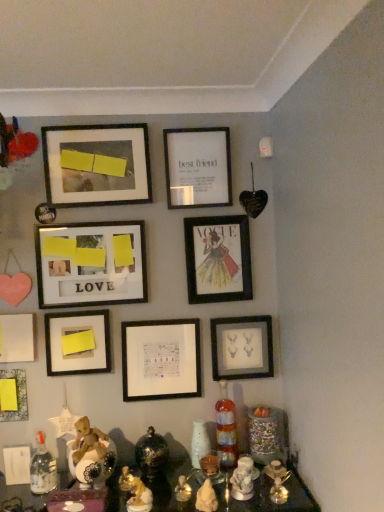
Identify the location of matte black picture frame at center, the second picture frame when ordered from bottom to top. click(161, 359).

Describe the element at coordinates (42, 468) in the screenshot. I see `translucent glass bottle at lower left, which ranks as the second bottle in back-to-front order` at that location.

Describe the element at coordinates (197, 167) in the screenshot. I see `white matte picture frame at upper center, which is the 9th picture frame from bottom to top` at that location.

This screenshot has width=384, height=512. Find the location of `white matte paper at lower left, marked as the 5th picture frame in a bottom-to-top arrangement`. white matte paper at lower left, marked as the 5th picture frame in a bottom-to-top arrangement is located at coordinates (16, 338).

Where is `matte black picture frame at center, the second picture frame when ordered from bottom to top`? The width and height of the screenshot is (384, 512). matte black picture frame at center, the second picture frame when ordered from bottom to top is located at coordinates tap(161, 359).

This screenshot has width=384, height=512. I want to click on the 2nd picture frame located above the matte wooden picture frame at center-left, positioned as the sixth picture frame in bottom-to-top order (from a real-world perspective), so click(197, 167).

In the scene shown: Which object is more forward, matte wooden picture frame at center-left, positioned as the sixth picture frame in bottom-to-top order, or white matte picture frame at upper center, which is the 9th picture frame from bottom to top?

matte wooden picture frame at center-left, positioned as the sixth picture frame in bottom-to-top order, is closer to the camera.

Is matte wooden picture frame at center-left, which ranks as the 4th picture frame in top-to-bottom order, not within white matte picture frame at upper center, which is the 9th picture frame from bottom to top?

Yes, matte wooden picture frame at center-left, which ranks as the 4th picture frame in top-to-bottom order, is outside of white matte picture frame at upper center, which is the 9th picture frame from bottom to top.

From the picture: Does matte wooden picture frame at center-left, positioned as the sixth picture frame in bottom-to-top order, appear on the right side of white matte picture frame at upper center, the first picture frame viewed from the top?

No.

Is the surface of matte black frame at center-right, the seventh picture frame in the top-to-bottom sequence, in direct contact with matte black picture frame at center, the second picture frame when ordered from bottom to top?

No, matte black frame at center-right, the seventh picture frame in the top-to-bottom sequence, is not next to matte black picture frame at center, the second picture frame when ordered from bottom to top.

From the picture: Does matte black frame at center-right, the seventh picture frame in the top-to-bottom sequence, have a greater height compared to matte black picture frame at center, the second picture frame when ordered from bottom to top?

No.

Measure the distance between matte black frame at center-right, the seventh picture frame in the top-to-bottom sequence, and matte black picture frame at center, the second picture frame when ordered from bottom to top.

matte black frame at center-right, the seventh picture frame in the top-to-bottom sequence, is 8.63 inches from matte black picture frame at center, the second picture frame when ordered from bottom to top.

From the image's perspective, which is above, matte black frame at center-right, the seventh picture frame in the top-to-bottom sequence, or matte black picture frame at center, the eighth picture frame when ordered from top to bottom?

From the image's view, matte black frame at center-right, the seventh picture frame in the top-to-bottom sequence, is above.

Based on the photo, which is more to the left, matte black picture frame at center, the eighth picture frame when ordered from top to bottom, or translucent glass candle holder at center?

matte black picture frame at center, the eighth picture frame when ordered from top to bottom.

Is matte black picture frame at center, the second picture frame when ordered from bottom to top, touching translucent glass candle holder at center?

No, matte black picture frame at center, the second picture frame when ordered from bottom to top, is not in contact with translucent glass candle holder at center.

At what (x,y) coordinates should I click in order to perform the action: click on candle holder that is under the matte black picture frame at center, the eighth picture frame when ordered from top to bottom (from a real-world perspective). Please return your answer as a coordinate pair (x, y). This screenshot has width=384, height=512. Looking at the image, I should click on (210, 468).

Is translucent glass bottle at lower right, the 2th bottle positioned from the front, turned away from matte wooden picture frame at center-left, which ranks as the 4th picture frame in top-to-bottom order?

translucent glass bottle at lower right, the 2th bottle positioned from the front, does not have its back to matte wooden picture frame at center-left, which ranks as the 4th picture frame in top-to-bottom order.

Is translucent glass bottle at lower right, placed as the first bottle when sorted from right to left, in front of or behind matte wooden picture frame at center-left, which ranks as the 4th picture frame in top-to-bottom order, in the image?

translucent glass bottle at lower right, placed as the first bottle when sorted from right to left, is in front of matte wooden picture frame at center-left, which ranks as the 4th picture frame in top-to-bottom order.

Does translucent glass bottle at lower right, positioned as the first bottle in back-to-front order, have a smaller size compared to matte wooden picture frame at center-left, which ranks as the 4th picture frame in top-to-bottom order?

Yes.

Looking at this image, is matte yellow paper at lower left, which appears as the 9th picture frame when viewed from the top, looking in the opposite direction of matte wooden picture frame at center-left, positioned as the sixth picture frame in bottom-to-top order?

matte yellow paper at lower left, which appears as the 9th picture frame when viewed from the top, does not have its back to matte wooden picture frame at center-left, positioned as the sixth picture frame in bottom-to-top order.

From a real-world perspective, is matte yellow paper at lower left, which appears as the 1th picture frame when ordered from the bottom, below matte wooden picture frame at center-left, positioned as the sixth picture frame in bottom-to-top order?

Indeed, from a real-world perspective, matte yellow paper at lower left, which appears as the 1th picture frame when ordered from the bottom, is positioned beneath matte wooden picture frame at center-left, positioned as the sixth picture frame in bottom-to-top order.

From the matte wooden picture frame at center-left, which ranks as the 4th picture frame in top-to-bottom order, count 1st picture frames forward and point to it. Please provide its 2D coordinates.

[(13, 395)]

Where is `candle holder located underneath the matte black picture frame at center, the second picture frame when ordered from bottom to top (from a real-world perspective)`? The width and height of the screenshot is (384, 512). candle holder located underneath the matte black picture frame at center, the second picture frame when ordered from bottom to top (from a real-world perspective) is located at coordinates (210, 468).

Does point (211, 461) come closer to viewer compared to point (154, 352)?

Yes.

Is translucent glass candle holder at center turned away from matte black picture frame at center, the eighth picture frame when ordered from top to bottom?

No, matte black picture frame at center, the eighth picture frame when ordered from top to bottom, is not at the back of translucent glass candle holder at center.

From the picture: From the image's perspective, is translucent glass candle holder at center on top of matte black picture frame at center, the second picture frame when ordered from bottom to top?

Incorrect, from the image's perspective, translucent glass candle holder at center is lower than matte black picture frame at center, the second picture frame when ordered from bottom to top.

From the image's perspective, which is above, matte black picture frame at center, positioned as the third picture frame in top-to-bottom order, or matte yellow paper at lower left, which appears as the 1th picture frame when ordered from the bottom?

matte black picture frame at center, positioned as the third picture frame in top-to-bottom order, appears higher in the image.

Is matte black picture frame at center, positioned as the third picture frame in top-to-bottom order, oriented away from matte yellow paper at lower left, which appears as the 9th picture frame when viewed from the top?

No, matte black picture frame at center, positioned as the third picture frame in top-to-bottom order, is not facing the opposite direction of matte yellow paper at lower left, which appears as the 9th picture frame when viewed from the top.

How many degrees apart are the facing directions of matte black picture frame at center, the seventh picture frame when ordered from bottom to top, and matte yellow paper at lower left, which appears as the 9th picture frame when viewed from the top?

0.834 degrees.

In the image, is matte black picture frame at center, the seventh picture frame when ordered from bottom to top, positioned in front of or behind matte yellow paper at lower left, which appears as the 9th picture frame when viewed from the top?

Clearly, matte black picture frame at center, the seventh picture frame when ordered from bottom to top, is behind matte yellow paper at lower left, which appears as the 9th picture frame when viewed from the top.

This screenshot has width=384, height=512. In order to click on the 2nd picture frame positioned below the white matte picture frame at upper center, the first picture frame viewed from the top (from a real-world perspective) in this screenshot , I will do `click(91, 264)`.

From a real-world perspective, count 1st picture frames upward from the matte black picture frame at center, the second picture frame when ordered from bottom to top, and point to it. Please provide its 2D coordinates.

[(242, 347)]

Based on their spatial positions, is white matte picture frame at upper center, the first picture frame viewed from the top, or yellow matte paper at lower left, positioned as the fourth picture frame in bottom-to-top order, closer to matte black frame at center-right, which is the third picture frame from bottom to top?

yellow matte paper at lower left, positioned as the fourth picture frame in bottom-to-top order, is positioned closer to the anchor matte black frame at center-right, which is the third picture frame from bottom to top.

Considering their positions, is matte yellow paper at lower left, which appears as the 1th picture frame when ordered from the bottom, positioned closer to matte wooden picture frame at center-left, which ranks as the 4th picture frame in top-to-bottom order, than matte black frame at upper left, marked as the 2th picture frame in a top-to-bottom arrangement?

Based on the image, matte black frame at upper left, marked as the 2th picture frame in a top-to-bottom arrangement, appears to be nearer to matte wooden picture frame at center-left, which ranks as the 4th picture frame in top-to-bottom order.

Which object lies nearer to the anchor point white matte paper at lower left, which ranks as the 5th picture frame in top-to-bottom order, matte yellow paper at lower left, which appears as the 1th picture frame when ordered from the bottom, or matte black frame at center-right, the seventh picture frame in the top-to-bottom sequence?

matte yellow paper at lower left, which appears as the 1th picture frame when ordered from the bottom, is positioned closer to the anchor white matte paper at lower left, which ranks as the 5th picture frame in top-to-bottom order.

Considering their positions, is yellow matte paper at lower left, acting as the sixth picture frame starting from the top, positioned closer to translucent glass bottle at lower left, placed as the second bottle when sorted from right to left, than matte black picture frame at center, the second picture frame when ordered from bottom to top?

The object closer to translucent glass bottle at lower left, placed as the second bottle when sorted from right to left, is yellow matte paper at lower left, acting as the sixth picture frame starting from the top.

In the scene shown: Looking at the image, which one is located further to matte wooden picture frame at center-left, which ranks as the 4th picture frame in top-to-bottom order, translucent glass bottle at lower left, which ranks as the 1th bottle in left-to-right order, or translucent glass bottle at lower right, the 2th bottle positioned from the front?

Based on the image, translucent glass bottle at lower right, the 2th bottle positioned from the front, appears to be further to matte wooden picture frame at center-left, which ranks as the 4th picture frame in top-to-bottom order.

Based on their spatial positions, is matte black frame at upper left, marked as the eighth picture frame in a bottom-to-top arrangement, or matte black picture frame at center, the seventh picture frame when ordered from bottom to top, further from translucent glass bottle at lower left, the 1th bottle positioned from the front?

matte black frame at upper left, marked as the eighth picture frame in a bottom-to-top arrangement, is positioned further to the anchor translucent glass bottle at lower left, the 1th bottle positioned from the front.

Which object lies nearer to the anchor point translucent glass bottle at lower left, which ranks as the second bottle in back-to-front order, matte black picture frame at center, the second picture frame when ordered from bottom to top, or yellow matte paper at lower left, positioned as the fourth picture frame in bottom-to-top order?

yellow matte paper at lower left, positioned as the fourth picture frame in bottom-to-top order, is positioned closer to the anchor translucent glass bottle at lower left, which ranks as the second bottle in back-to-front order.

Which object lies further to the anchor point translucent glass bottle at lower right, the second bottle viewed from the left, matte black picture frame at center, positioned as the third picture frame in top-to-bottom order, or matte yellow paper at lower left, which appears as the 9th picture frame when viewed from the top?

Among the two, matte yellow paper at lower left, which appears as the 9th picture frame when viewed from the top, is located further to translucent glass bottle at lower right, the second bottle viewed from the left.

Find the location of a particular element. The image size is (384, 512). bottle between white matte picture frame at upper center, the first picture frame viewed from the top, and translucent glass bottle at lower left, placed as the second bottle when sorted from right to left, in the up-down direction is located at coordinates (226, 429).

Identify the location of bottle between matte wooden picture frame at center-left, which ranks as the 4th picture frame in top-to-bottom order, and matte black frame at center-right, the seventh picture frame in the top-to-bottom sequence, from left to right. (226, 429).

This screenshot has width=384, height=512. What are the coordinates of `bottle between matte black picture frame at center, the eighth picture frame when ordered from top to bottom, and matte black frame at center-right, the seventh picture frame in the top-to-bottom sequence, from left to right` in the screenshot? It's located at (226, 429).

You are a GUI agent. You are given a task and a screenshot of the screen. Output one action in this format:
    pyautogui.click(x=<x>, y=<y>)
    Task: Click on the candle holder between matte yellow paper at lower left, which appears as the 1th picture frame when ordered from the bottom, and matte black frame at center-right, which is the third picture frame from bottom to top
    This screenshot has height=512, width=384.
    Given the screenshot: What is the action you would take?
    pyautogui.click(x=210, y=468)